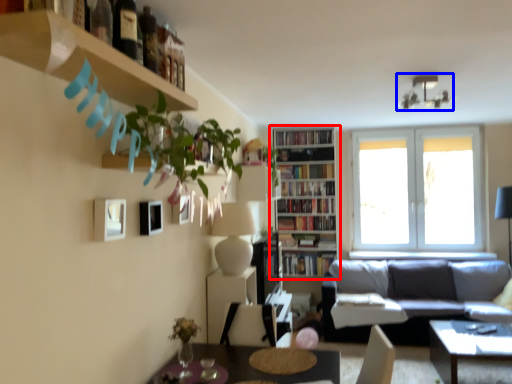
Question: Which object is further to the camera taking this photo, bookcase (highlighted by a red box) or lamp (highlighted by a blue box)?

Choices:
 (A) bookcase
 (B) lamp

Answer: (A)